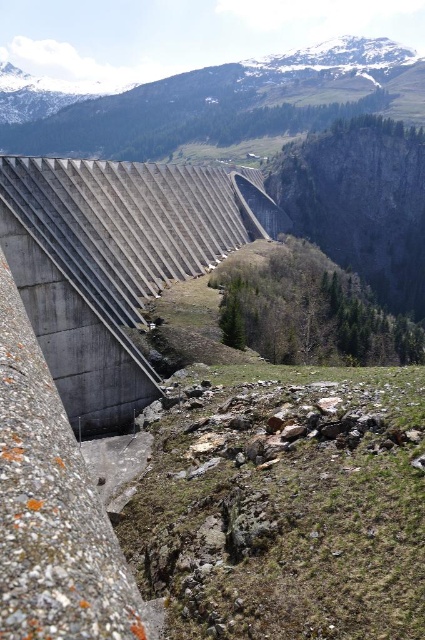
You are a surveyor standing at the point marked by the coordinates point (115, 262). Based on the scene, what structure are you currently positioned on?

The point (115, 262) marks the concrete dam at center, so you are positioned on the concrete dam at center.

Based on the scene description, what is the 2D coordinate of the concrete dam at center?

The concrete dam at center is located at the 2D coordinate point of (115, 262).

You are a hiker planning to take a photo of the concrete dam at center and the snowy granite mountain at upper center. Which object will appear smaller in your photo?

The concrete dam at center will appear smaller in the photo because it occupies less space than the snowy granite mountain at upper center.